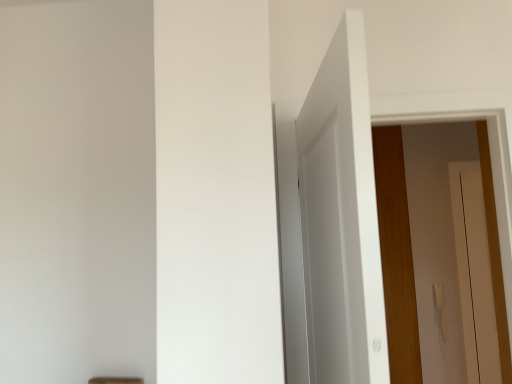
Image resolution: width=512 pixels, height=384 pixels. What are the coordinates of `wooden door at right, positioned as the 1th door in back-to-front order` in the screenshot? It's located at (396, 256).

Image resolution: width=512 pixels, height=384 pixels. Describe the element at coordinates (396, 256) in the screenshot. I see `wooden door at right, the 2th door viewed from the left` at that location.

Measure the distance between wooden door at right, which appears as the second door when viewed from the front, and camera.

wooden door at right, which appears as the second door when viewed from the front, and camera are 3.09 meters apart from each other.

The width and height of the screenshot is (512, 384). What do you see at coordinates (340, 219) in the screenshot?
I see `white matte door at upper center, the first door viewed from the left` at bounding box center [340, 219].

In order to click on white matte door at upper center, acting as the first door starting from the front in this screenshot , I will do `click(340, 219)`.

Identify the location of wooden door at right, the 2th door viewed from the left. This screenshot has width=512, height=384. (396, 256).

Visually, is white matte door at upper center, acting as the second door starting from the right, positioned to the left or to the right of wooden door at right, which appears as the second door when viewed from the front?

From the image, it's evident that white matte door at upper center, acting as the second door starting from the right, is to the left of wooden door at right, which appears as the second door when viewed from the front.

Which object is closer to the camera, white matte door at upper center, placed as the second door when sorted from back to front, or wooden door at right, the 2th door viewed from the left?

white matte door at upper center, placed as the second door when sorted from back to front, is in front.

Does point (320, 201) appear closer or farther from the camera than point (412, 368)?

Point (320, 201) appears to be closer to the viewer than point (412, 368).

From the image's perspective, is white matte door at upper center, placed as the second door when sorted from back to front, below wooden door at right, which appears as the second door when viewed from the front?

No, from the image's perspective, white matte door at upper center, placed as the second door when sorted from back to front, is not below wooden door at right, which appears as the second door when viewed from the front.

From a real-world perspective, who is located higher, white matte door at upper center, acting as the second door starting from the right, or wooden door at right, the 2th door viewed from the left?

In real-world perspective, white matte door at upper center, acting as the second door starting from the right, is above.

Which object is thinner, white matte door at upper center, acting as the second door starting from the right, or wooden door at right, the 1th door viewed from the right?

white matte door at upper center, acting as the second door starting from the right.

Is white matte door at upper center, placed as the second door when sorted from back to front, taller or shorter than wooden door at right, positioned as the 1th door in back-to-front order?

white matte door at upper center, placed as the second door when sorted from back to front, is shorter than wooden door at right, positioned as the 1th door in back-to-front order.

Between white matte door at upper center, acting as the first door starting from the front, and wooden door at right, the 2th door viewed from the left, which one has smaller size?

With smaller size is white matte door at upper center, acting as the first door starting from the front.

Which is correct: white matte door at upper center, acting as the second door starting from the right, is inside wooden door at right, the 2th door viewed from the left, or outside of it?

white matte door at upper center, acting as the second door starting from the right, is not inside wooden door at right, the 2th door viewed from the left, it's outside.

Is white matte door at upper center, the first door viewed from the left, next to wooden door at right, positioned as the 1th door in back-to-front order, and touching it?

No, white matte door at upper center, the first door viewed from the left, is not making contact with wooden door at right, positioned as the 1th door in back-to-front order.

Is white matte door at upper center, acting as the first door starting from the front, facing away from wooden door at right, positioned as the 1th door in back-to-front order?

No, white matte door at upper center, acting as the first door starting from the front,'s orientation is not away from wooden door at right, positioned as the 1th door in back-to-front order.

How many degrees apart are the facing directions of white matte door at upper center, acting as the first door starting from the front, and wooden door at right, positioned as the 1th door in back-to-front order?

They differ by 95.6 degrees in their facing directions.

Measure the distance between white matte door at upper center, placed as the second door when sorted from back to front, and wooden door at right, which appears as the second door when viewed from the front.

2.01 meters.

The image size is (512, 384). Find the location of `door that is under the white matte door at upper center, placed as the second door when sorted from back to front (from a real-world perspective)`. door that is under the white matte door at upper center, placed as the second door when sorted from back to front (from a real-world perspective) is located at coordinates pyautogui.click(x=396, y=256).

Is wooden door at right, the 1th door viewed from the right, at the left side of white matte door at upper center, placed as the second door when sorted from back to front?

No.

Is the position of wooden door at right, the 2th door viewed from the left, less distant than that of white matte door at upper center, the first door viewed from the left?

No, wooden door at right, the 2th door viewed from the left, is behind white matte door at upper center, the first door viewed from the left.

Which is further, (400, 266) or (368, 297)?

The point (400, 266) is behind.

From the image's perspective, is wooden door at right, the 2th door viewed from the left, located above or below white matte door at upper center, acting as the first door starting from the front?

Clearly, from the image's perspective, wooden door at right, the 2th door viewed from the left, is below white matte door at upper center, acting as the first door starting from the front.

Consider the image. From a real-world perspective, is wooden door at right, the 1th door viewed from the right, positioned under white matte door at upper center, the first door viewed from the left, based on gravity?

Yes.

Which of these two, wooden door at right, which appears as the second door when viewed from the front, or white matte door at upper center, acting as the first door starting from the front, is wider?

Wider between the two is wooden door at right, which appears as the second door when viewed from the front.

Considering the relative sizes of wooden door at right, the 2th door viewed from the left, and white matte door at upper center, acting as the first door starting from the front, in the image provided, is wooden door at right, the 2th door viewed from the left, shorter than white matte door at upper center, acting as the first door starting from the front,?

Incorrect, the height of wooden door at right, the 2th door viewed from the left, does not fall short of that of white matte door at upper center, acting as the first door starting from the front.

Which of these two, wooden door at right, the 1th door viewed from the right, or white matte door at upper center, the first door viewed from the left, is bigger?

With larger size is wooden door at right, the 1th door viewed from the right.

Would you say wooden door at right, the 2th door viewed from the left, is inside or outside white matte door at upper center, acting as the first door starting from the front?

wooden door at right, the 2th door viewed from the left, exists outside the volume of white matte door at upper center, acting as the first door starting from the front.

Can you see wooden door at right, which appears as the second door when viewed from the front, touching white matte door at upper center, acting as the second door starting from the right?

There is a gap between wooden door at right, which appears as the second door when viewed from the front, and white matte door at upper center, acting as the second door starting from the right.

Could you tell me if wooden door at right, the 1th door viewed from the right, is turned towards white matte door at upper center, acting as the second door starting from the right?

No.

Measure the distance from wooden door at right, positioned as the 1th door in back-to-front order, to white matte door at upper center, acting as the first door starting from the front.

wooden door at right, positioned as the 1th door in back-to-front order, is 6.59 feet away from white matte door at upper center, acting as the first door starting from the front.

In the image, there is a wooden door at right, which appears as the second door when viewed from the front. Identify the location of door above it (from the image's perspective). (340, 219).

Image resolution: width=512 pixels, height=384 pixels. Find the location of `door behind the white matte door at upper center, placed as the second door when sorted from back to front`. door behind the white matte door at upper center, placed as the second door when sorted from back to front is located at coordinates click(396, 256).

Image resolution: width=512 pixels, height=384 pixels. I want to click on door above the wooden door at right, the 2th door viewed from the left (from a real-world perspective), so click(x=340, y=219).